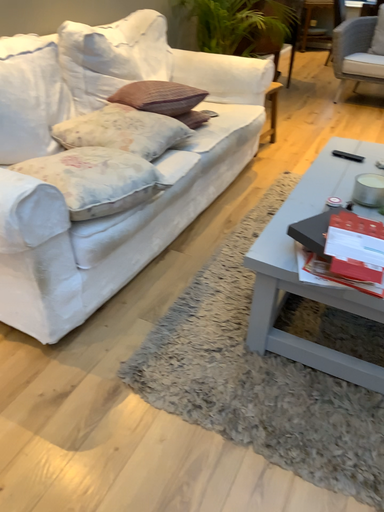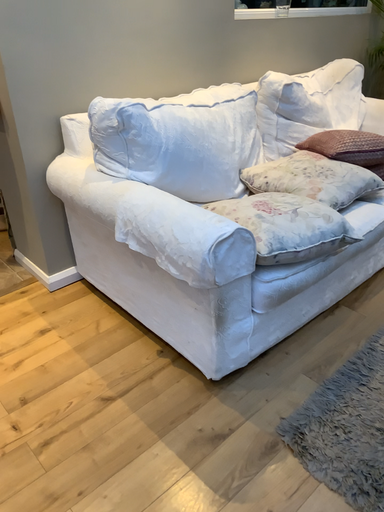
Question: Which way did the camera rotate in the video?

Choices:
 (A) rotated downward
 (B) rotated upward

Answer: (B)